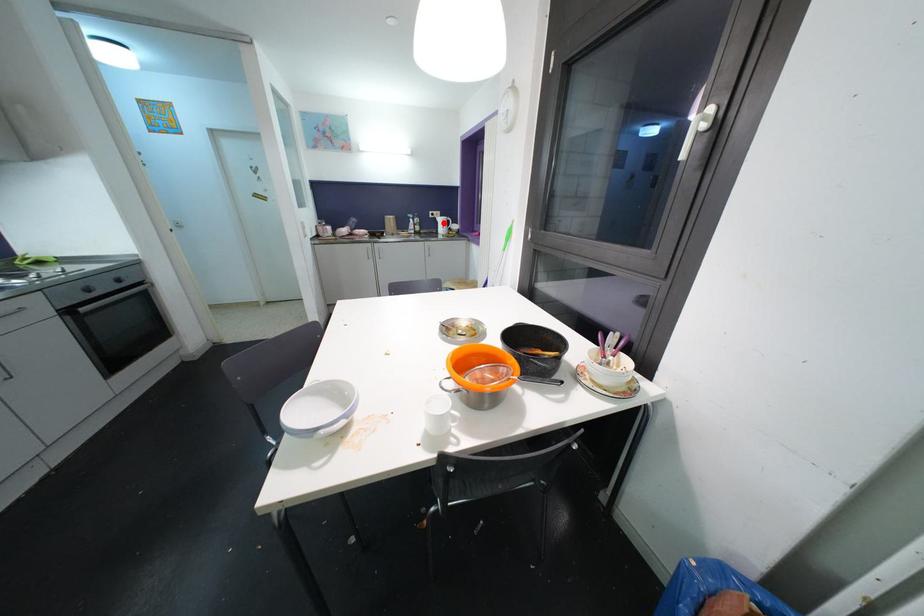
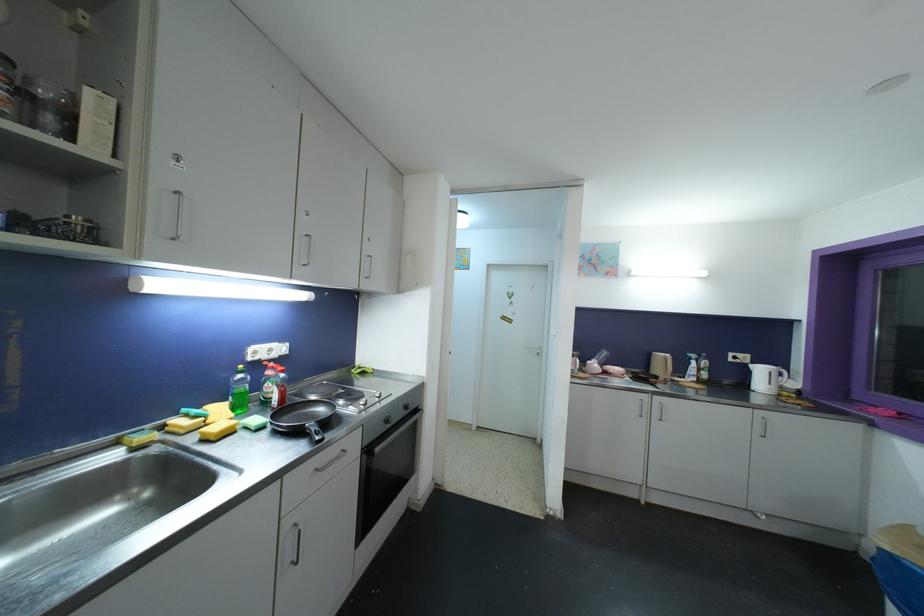
Find the pixel in the second image that matches the highlighted location in the first image.

(763, 373)